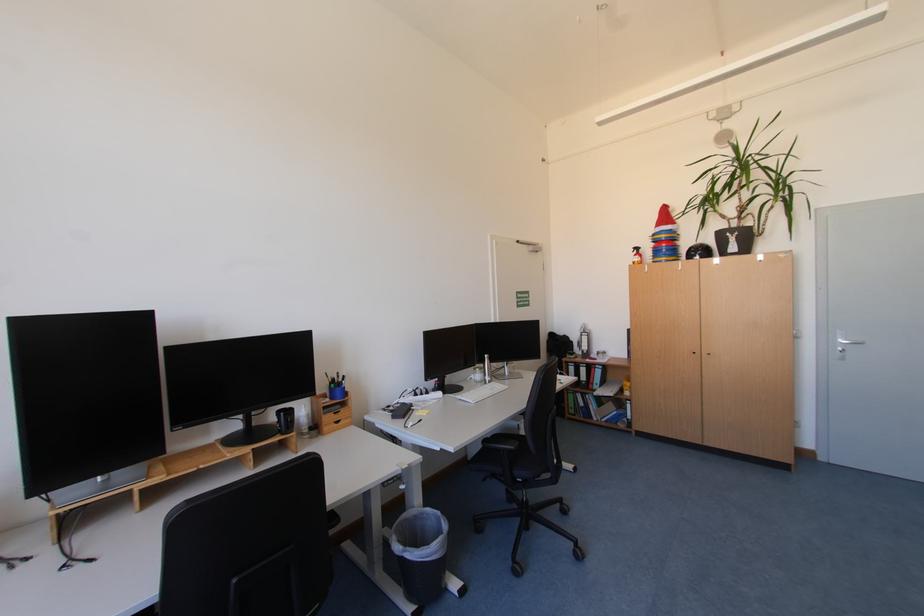
The location [285,419] corresponds to which object?

It refers to a black mug.